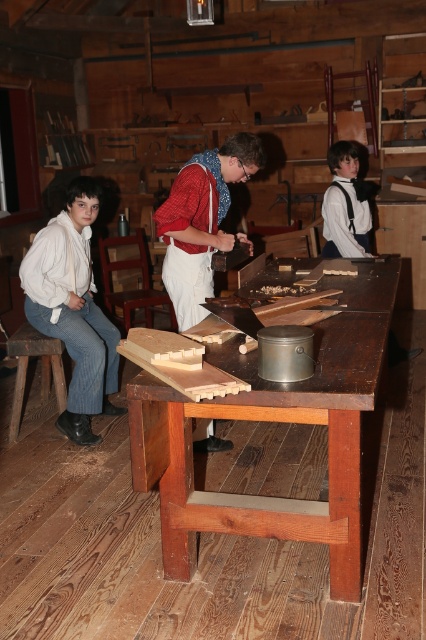
Question: Does matte red shirt at center have a larger size compared to wooden at left?

Choices:
 (A) no
 (B) yes

Answer: (B)

Question: Is matte red shirt at center smaller than wooden at left?

Choices:
 (A) yes
 (B) no

Answer: (B)

Question: Among these points, which one is nearest to the camera?

Choices:
 (A) (342, 173)
 (B) (58, 372)

Answer: (B)

Question: Which point is closer to the camera?

Choices:
 (A) white cotton shirt at center
 (B) wooden at left
 (C) matte red shirt at center
 (D) wooden table at center

Answer: (D)

Question: Can you confirm if matte red shirt at center is positioned to the left of wooden at left?

Choices:
 (A) yes
 (B) no

Answer: (B)

Question: Considering the real-world distances, which object is farthest from the matte red shirt at center?

Choices:
 (A) wooden at left
 (B) wooden table at center
 (C) white cotton shirt at center

Answer: (C)